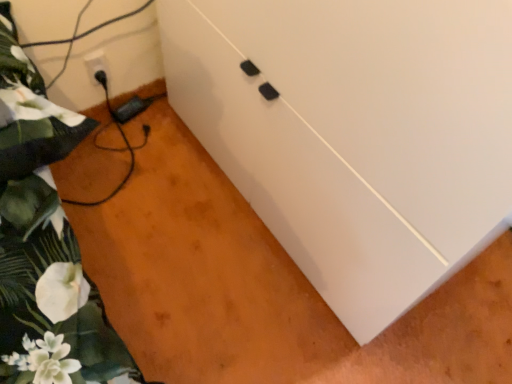
Question: Is white matte cabinet at center further to camera compared to green floral fabric at left?

Choices:
 (A) no
 (B) yes

Answer: (A)

Question: Would you say white matte cabinet at center is outside green floral fabric at left?

Choices:
 (A) yes
 (B) no

Answer: (A)

Question: Is white matte cabinet at center taller than green floral fabric at left?

Choices:
 (A) yes
 (B) no

Answer: (A)

Question: From a real-world perspective, does white matte cabinet at center stand above green floral fabric at left?

Choices:
 (A) yes
 (B) no

Answer: (A)

Question: Is white matte cabinet at center smaller than green floral fabric at left?

Choices:
 (A) no
 (B) yes

Answer: (A)

Question: Does point (24, 94) appear closer or farther from the camera than point (89, 54)?

Choices:
 (A) closer
 (B) farther

Answer: (A)

Question: Is green floral fabric at left to the left or to the right of white plastic electric outlet at lower left in the image?

Choices:
 (A) right
 (B) left

Answer: (A)

Question: Is green floral fabric at left taller or shorter than white plastic electric outlet at lower left?

Choices:
 (A) tall
 (B) short

Answer: (A)

Question: Is green floral fabric at left bigger or smaller than white plastic electric outlet at lower left?

Choices:
 (A) big
 (B) small

Answer: (A)

Question: In terms of height, does green floral fabric at left look taller or shorter compared to white matte cabinet at center?

Choices:
 (A) tall
 (B) short

Answer: (B)

Question: Is green floral fabric at left wider or thinner than white matte cabinet at center?

Choices:
 (A) wide
 (B) thin

Answer: (A)

Question: In terms of size, does green floral fabric at left appear bigger or smaller than white matte cabinet at center?

Choices:
 (A) small
 (B) big

Answer: (A)

Question: From a real-world perspective, is green floral fabric at left physically located above or below white matte cabinet at center?

Choices:
 (A) below
 (B) above

Answer: (A)

Question: Considering their positions, is white plastic electric outlet at lower left located in front of or behind white matte cabinet at center?

Choices:
 (A) front
 (B) behind

Answer: (B)

Question: From a real-world perspective, is white plastic electric outlet at lower left physically located above or below white matte cabinet at center?

Choices:
 (A) above
 (B) below

Answer: (B)